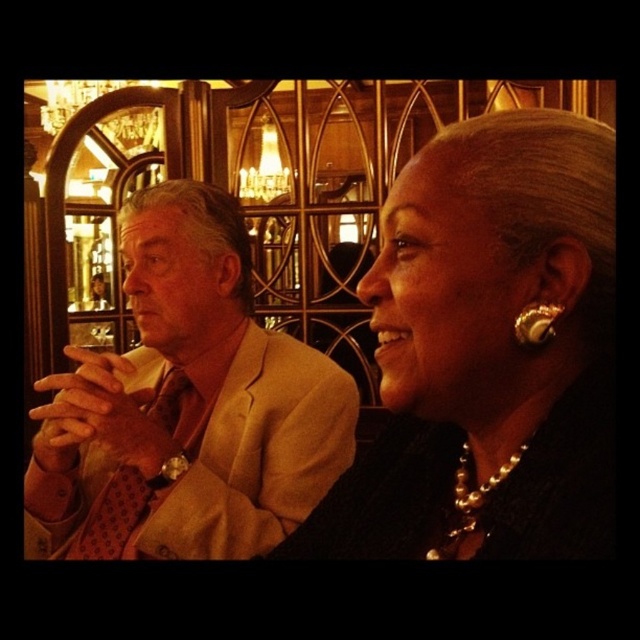
Question: Does pearl necklace at center appear on the left side of beige textured suit at left?

Choices:
 (A) no
 (B) yes

Answer: (A)

Question: Is pearl necklace at center closer to camera compared to beige textured suit at left?

Choices:
 (A) no
 (B) yes

Answer: (B)

Question: Which object appears farthest from the camera in this image?

Choices:
 (A) pearl necklace at center
 (B) beige textured suit at left

Answer: (B)

Question: Can you confirm if pearl necklace at center is smaller than beige textured suit at left?

Choices:
 (A) yes
 (B) no

Answer: (B)